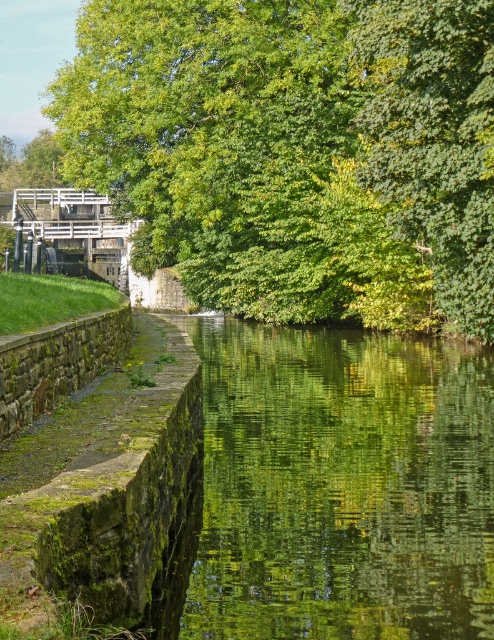
You are navigating a small boat along the canal and want to reach a destination located at point (77, 536). There is an obstacle at point (320, 189). Which point should you avoid to ensure safe passage?

You should avoid point (320, 189) because it is behind point (77, 536), meaning it is further along your path and could block your route to the destination.

You are standing at the edge of the canal and want to take a photo of the green leafy tree at upper center. If your camera has a maximum zoom range of 20 meters, will you be able to capture the tree clearly without moving closer?

The green leafy tree at upper center is 21.89 meters away from the viewer, which exceeds the camera maximum zoom range of 20 meters. Therefore, you won not be able to capture the tree clearly without moving closer.

You are standing at the edge of a canal and want to place a 3.5 meter long wooden board between the green mossy stone at left and the opposite bank. Can the board reach the other side?

The green mossy stone at left is 3.52 meters from camera. Since the board is 3.5 meters long, it is slightly shorter than the distance to the stone, so the board cannot reach the other side.